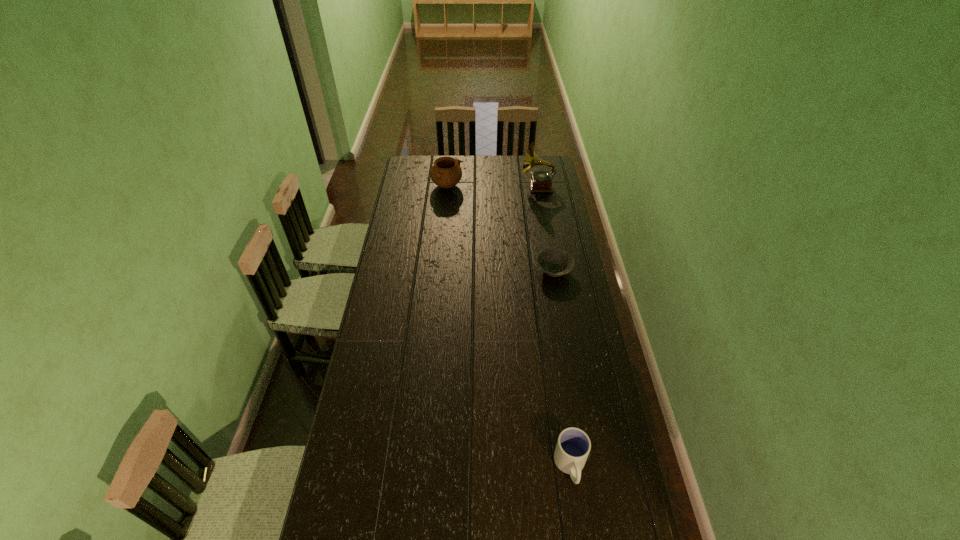
Identify the location of the closest object to the phonograph_record. The image size is (960, 540). (446, 172).

You are a GUI agent. You are given a task and a screenshot of the screen. Output one action in this format:
    pyautogui.click(x=<x>, y=<y>)
    Task: Click on the vacant space that satisfies the following two spatial constraints: 1. on the horn of the phonograph_record; 2. with the handle on the side of the nearest object
    Image resolution: width=960 pixels, height=540 pixels.
    Given the screenshot: What is the action you would take?
    pyautogui.click(x=585, y=466)

Find the location of a particular element. free location that satisfies the following two spatial constraints: 1. on the horn of the tallest object; 2. on the right side of the bowl is located at coordinates (552, 271).